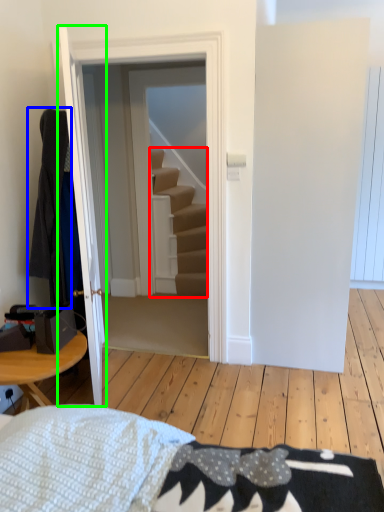
Question: Considering the real-world distances, which object is closest to stairs (highlighted by a red box)? robe (highlighted by a blue box) or door (highlighted by a green box).

Choices:
 (A) robe
 (B) door

Answer: (A)